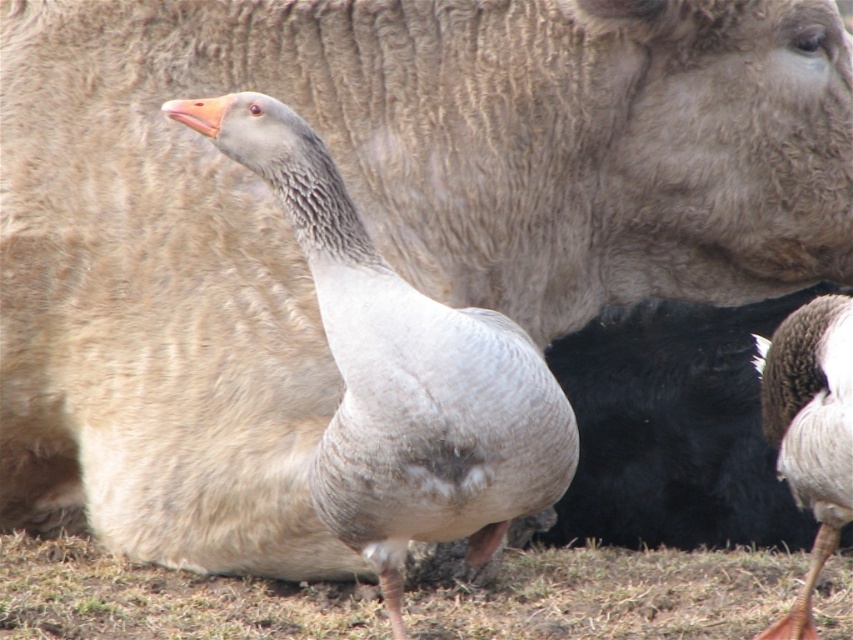
Does gray downy duck at center have a greater height compared to gray feathered duck at center?

Correct, gray downy duck at center is much taller as gray feathered duck at center.

Is gray downy duck at center smaller than gray feathered duck at center?

Actually, gray downy duck at center might be larger than gray feathered duck at center.

Between point (413, 412) and point (815, 637), which one is positioned in front?

Point (413, 412) is in front.

This screenshot has width=853, height=640. I want to click on gray downy duck at center, so click(x=401, y=372).

This screenshot has width=853, height=640. Describe the element at coordinates (401, 372) in the screenshot. I see `gray downy duck at center` at that location.

What are the coordinates of `gray downy duck at center` in the screenshot? It's located at (401, 372).

Is green grass at lower center taller than gray feathered duck at center?

No.

Is point (165, 611) closer to viewer compared to point (758, 342)?

Yes, point (165, 611) is in front of point (758, 342).

Where is `green grass at lower center`? This screenshot has height=640, width=853. green grass at lower center is located at coordinates (614, 595).

Locate an element on the screen. green grass at lower center is located at coordinates (614, 595).